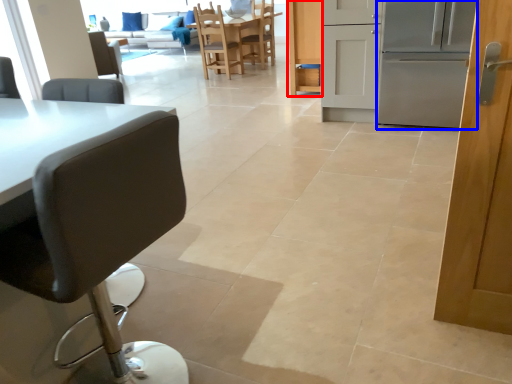
Question: Which point is further to the camera, cabinetry (highlighted by a red box) or oven (highlighted by a blue box)?

Choices:
 (A) cabinetry
 (B) oven

Answer: (A)